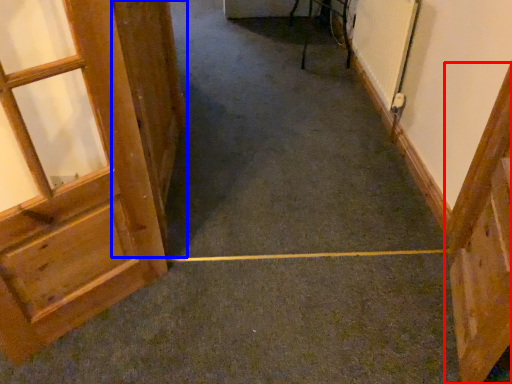
Question: Among these objects, which one is nearest to the camera, door (highlighted by a red box) or door (highlighted by a blue box)?

Choices:
 (A) door
 (B) door

Answer: (A)